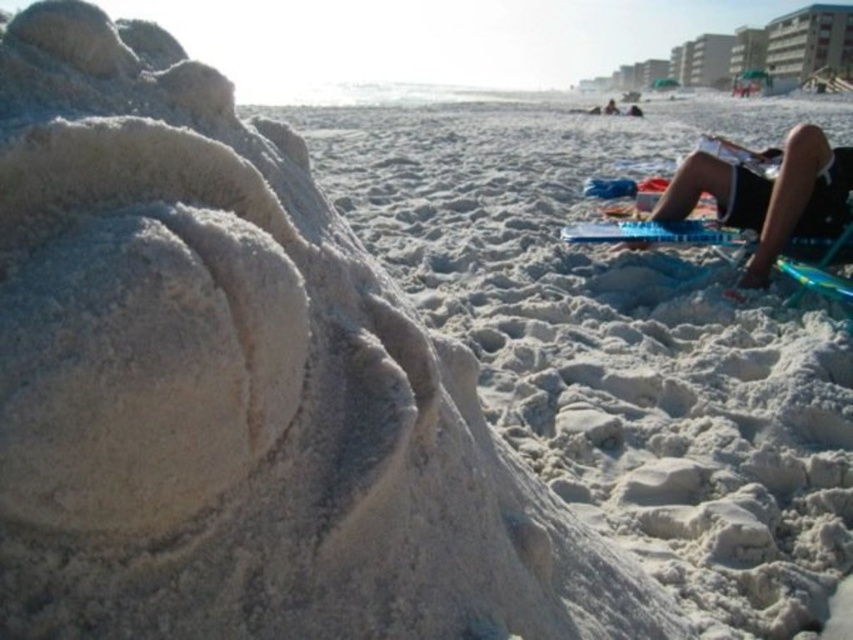
Question: Where is white sandcastle at left located in relation to black fabric shorts at upper right in the image?

Choices:
 (A) left
 (B) right

Answer: (A)

Question: Which point is closer to the camera taking this photo?

Choices:
 (A) (509, 141)
 (B) (785, 188)

Answer: (B)

Question: Does white sandcastle at left have a lesser width compared to black fabric shorts at upper right?

Choices:
 (A) no
 (B) yes

Answer: (A)

Question: Is white sandcastle at left smaller than black fabric shorts at upper right?

Choices:
 (A) no
 (B) yes

Answer: (A)